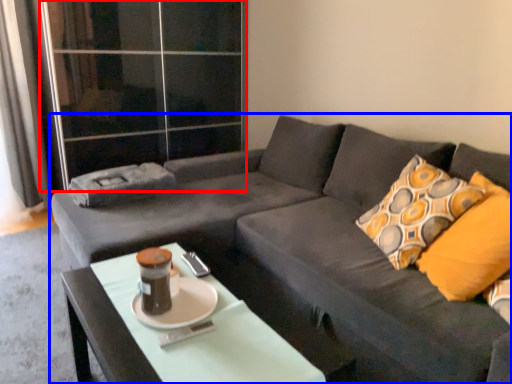
Question: Which object is further to the camera taking this photo, glass door (highlighted by a red box) or studio couch (highlighted by a blue box)?

Choices:
 (A) glass door
 (B) studio couch

Answer: (A)